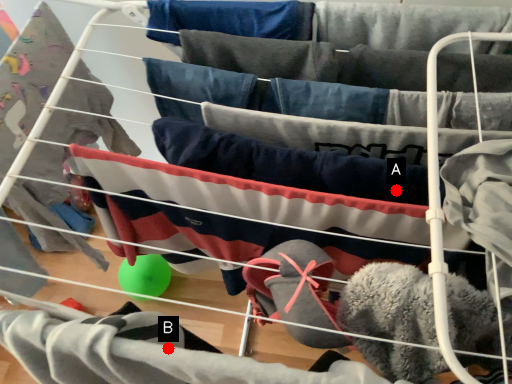
Question: Two points are circled on the image, labeled by A and B beside each circle. Which point is farther from the camera taking this photo?

Choices:
 (A) A is further
 (B) B is further

Answer: (A)